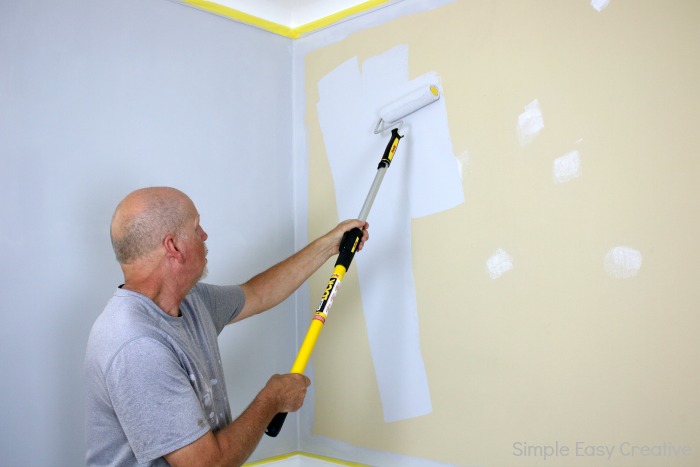
What are the coordinates of `paint roller handle` in the screenshot? It's located at (390, 146).